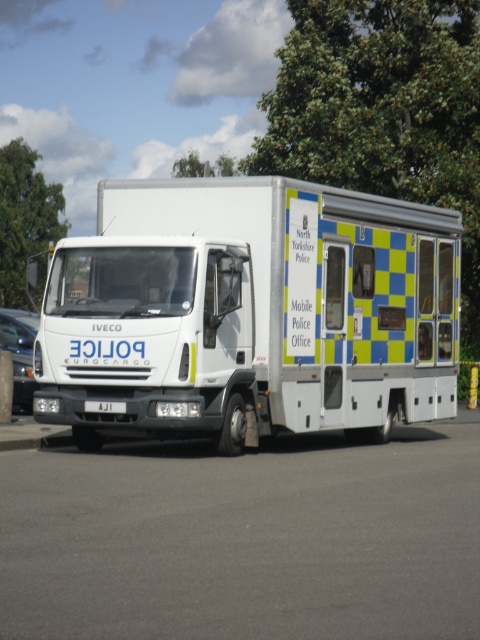
You are a photographer standing at the camera position. You want to take a photo of the truck but need to know which point is closer to you to focus properly. Which point, point (244, 413) or point (214, 172), is closer to your current position?

Point (244, 413) is closer to the camera than point (214, 172), so you should focus on that point to capture the truck clearly.

You are standing at the back of the white Iveco Eurocargo police truck. You see two points marked on the ground near the truck. The first point is at coordinates point (419, 410) and the second point is at point (23, 232). Which point is closer to you?

Point (23, 232) is closer to you because it is behind point (419, 410), and you are standing at the back of the truck.

You are a police officer standing at the back of the white Iveco Eurocargo vehicle. You need to see the green leafy tree at upper center. In which direction should you look relative to your position?

The green leafy tree at upper center is located at coordinates 0.259 on the x axis and 0.427 on the y axis. Since you are at the back of the truck, you should look forward and slightly to the left to see the green leafy tree at upper center.